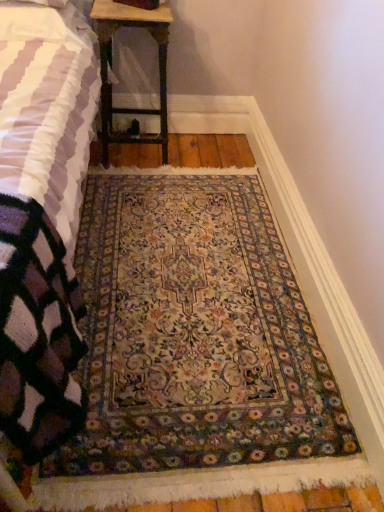
Question: Is carpeted rug at center wider than wooden table at upper center?

Choices:
 (A) no
 (B) yes

Answer: (B)

Question: Is carpeted rug at center at the left side of wooden table at upper center?

Choices:
 (A) yes
 (B) no

Answer: (B)

Question: Could you tell me if carpeted rug at center is facing wooden table at upper center?

Choices:
 (A) yes
 (B) no

Answer: (B)

Question: Can wooden table at upper center be found inside carpeted rug at center?

Choices:
 (A) yes
 (B) no

Answer: (B)

Question: From a real-world perspective, is carpeted rug at center positioned over wooden table at upper center based on gravity?

Choices:
 (A) yes
 (B) no

Answer: (B)

Question: Looking at the image, does carpeted rug at center seem bigger or smaller compared to wooden table at upper center?

Choices:
 (A) small
 (B) big

Answer: (B)

Question: Considering the relative positions of carpeted rug at center and wooden table at upper center in the image provided, is carpeted rug at center to the left or to the right of wooden table at upper center?

Choices:
 (A) left
 (B) right

Answer: (B)

Question: In the image, is carpeted rug at center positioned in front of or behind wooden table at upper center?

Choices:
 (A) front
 (B) behind

Answer: (A)

Question: Do you think carpeted rug at center is within wooden table at upper center, or outside of it?

Choices:
 (A) inside
 (B) outside

Answer: (B)

Question: Is point (139, 344) closer or farther from the camera than point (18, 445)?

Choices:
 (A) farther
 (B) closer

Answer: (A)

Question: From a real-world perspective, is carpeted rug at center above or below knitted wool blanket at lower left?

Choices:
 (A) above
 (B) below

Answer: (B)

Question: Considering the positions of carpeted rug at center and knitted wool blanket at lower left in the image, is carpeted rug at center wider or thinner than knitted wool blanket at lower left?

Choices:
 (A) thin
 (B) wide

Answer: (A)

Question: Considering the positions of carpeted rug at center and knitted wool blanket at lower left in the image, is carpeted rug at center bigger or smaller than knitted wool blanket at lower left?

Choices:
 (A) big
 (B) small

Answer: (B)

Question: Is knitted wool blanket at lower left wider or thinner than carpeted rug at center?

Choices:
 (A) wide
 (B) thin

Answer: (A)

Question: Is knitted wool blanket at lower left situated inside carpeted rug at center or outside?

Choices:
 (A) inside
 (B) outside

Answer: (B)